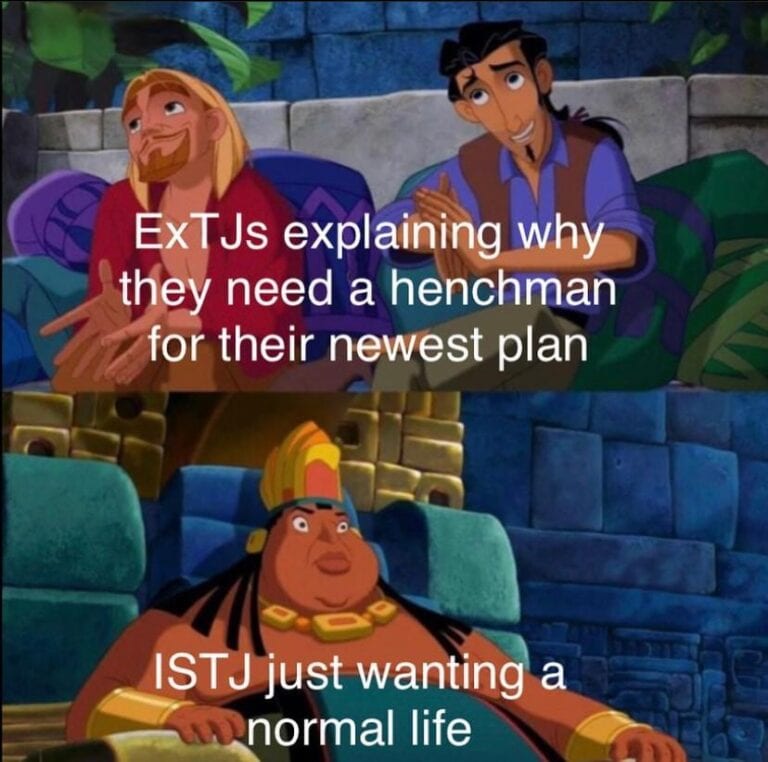
At what (x,y) coordinates should I click in order to perform the action: click on plant. Please return your answer as a coordinate pair (x, y). This screenshot has height=762, width=768. Looking at the image, I should click on (64, 47).